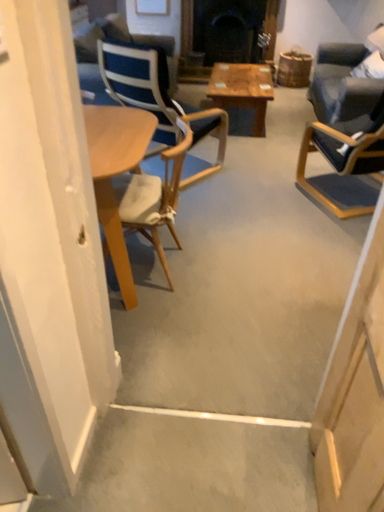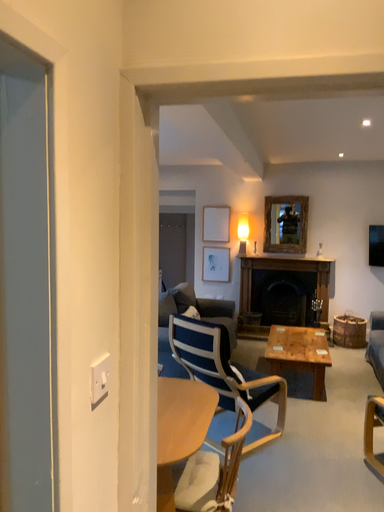
Question: Which way did the camera rotate in the video?

Choices:
 (A) rotated left
 (B) rotated right

Answer: (A)